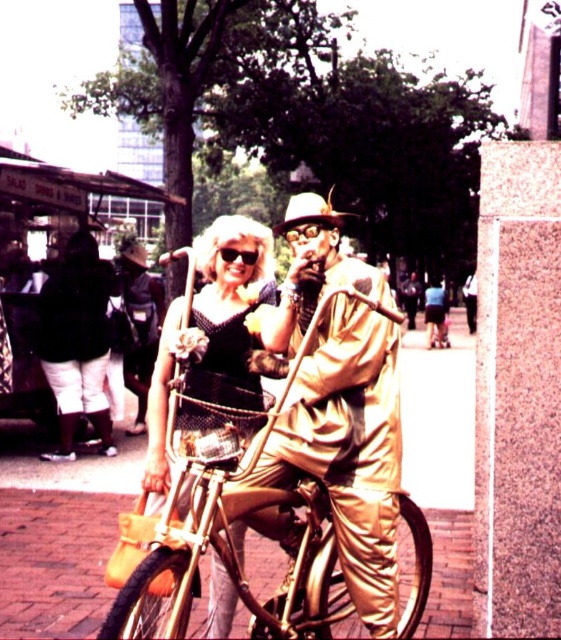
The image size is (561, 640). What do you see at coordinates (226, 556) in the screenshot?
I see `gold shiny bicycle at center` at bounding box center [226, 556].

Which is above, gold shiny bicycle at center or shiny gold dress at center?

shiny gold dress at center is above.

Which is behind, point (295, 520) or point (223, 636)?

The point (223, 636) is behind.

Where is `gold shiny bicycle at center`? This screenshot has height=640, width=561. gold shiny bicycle at center is located at coordinates (226, 556).

Which is in front, point (394, 573) or point (227, 260)?

Positioned in front is point (394, 573).

Is point (328, 253) closer to camera compared to point (257, 380)?

That is False.

At what (x,y) coordinates should I click in order to perform the action: click on gold metallic suit at center. Please return your answer as a coordinate pair (x, y). The height and width of the screenshot is (640, 561). Looking at the image, I should click on (348, 449).

Who is positioned more to the left, gold metallic suit at center or gold shiny bicycle at center?

gold shiny bicycle at center

Image resolution: width=561 pixels, height=640 pixels. Find the location of `gold metallic suit at center`. gold metallic suit at center is located at coordinates (348, 449).

Locate an element on the screen. This screenshot has height=640, width=561. gold metallic suit at center is located at coordinates (348, 449).

You are a GUI agent. You are given a task and a screenshot of the screen. Output one action in this format:
    pyautogui.click(x=<x>, y=<y>)
    Task: Click on the gold metallic suit at center
    
    Given the screenshot: What is the action you would take?
    pyautogui.click(x=348, y=449)